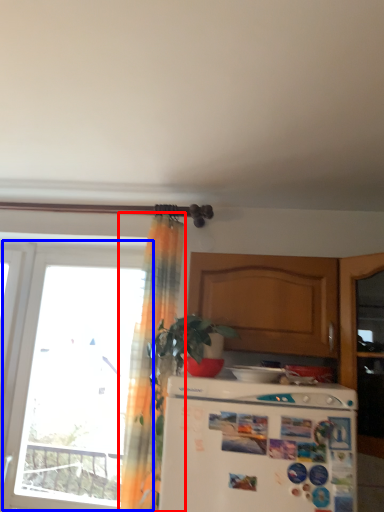
Question: Among these objects, which one is nearest to the camera, curtain (highlighted by a red box) or window (highlighted by a blue box)?

Choices:
 (A) curtain
 (B) window

Answer: (A)